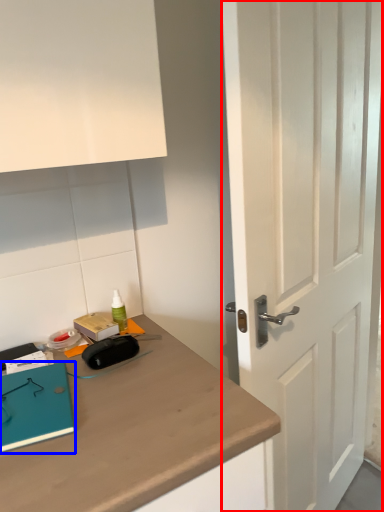
Question: Which of the following is the closest to the observer, door (highlighted by a red box) or notebook (highlighted by a blue box)?

Choices:
 (A) door
 (B) notebook

Answer: (A)